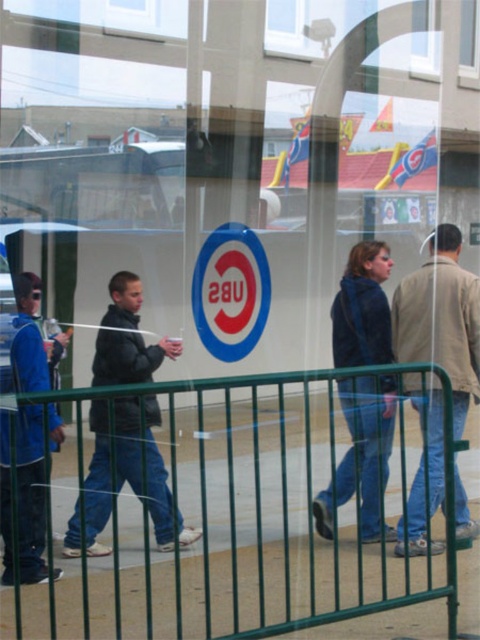
You are a tailor observing two jackets reflected in a window. The jackets are the tan leather jacket at center and the dark blue jacket at center. Which jacket appears taller in the reflection?

The tan leather jacket at center appears taller than the dark blue jacket at center in the reflection.

You are standing in front of the glass window and see two points marked on it. The first point is at coordinate point [349,420] and the second is at point [467,49]. Which point is closer to your eyes?

Point [349,420] is closer to the camera than point [467,49], so the first point is closer to your eyes.